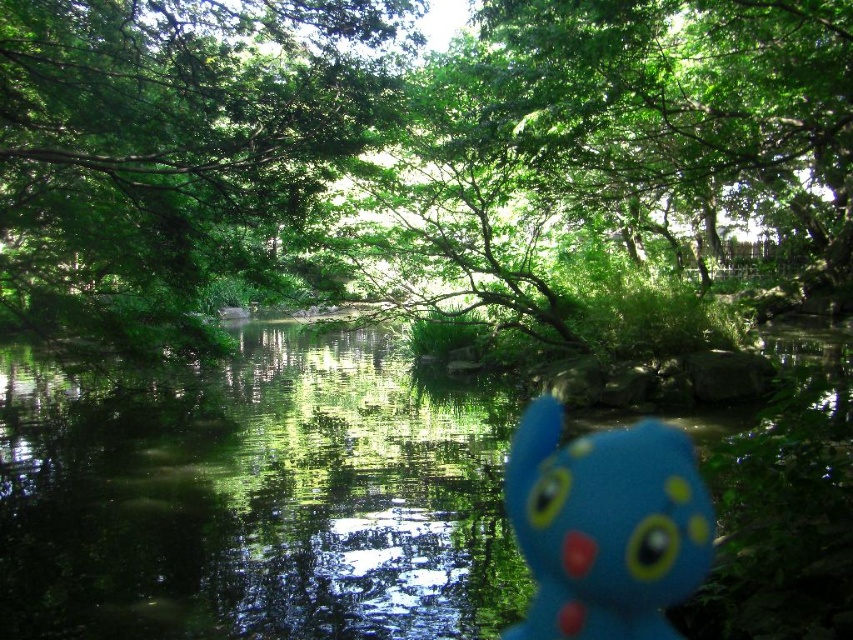
You are a photographer trying to capture the reflection of the green reflective water at center in your shot. To ensure the reflection is clear, you need to position your camera directly above the water. Based on the coordinates provided, where should you aim your camera?

The green reflective water at center is located at point (254, 497), so you should aim your camera directly above those coordinates to capture its reflection clearly.